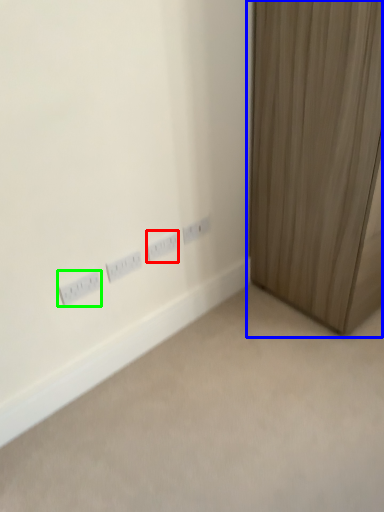
Question: Based on their relative distances, which object is nearer to power plugs and sockets (highlighted by a red box)? Choose from curtain (highlighted by a blue box) and power plugs and sockets (highlighted by a green box).

Choices:
 (A) curtain
 (B) power plugs and sockets

Answer: (B)